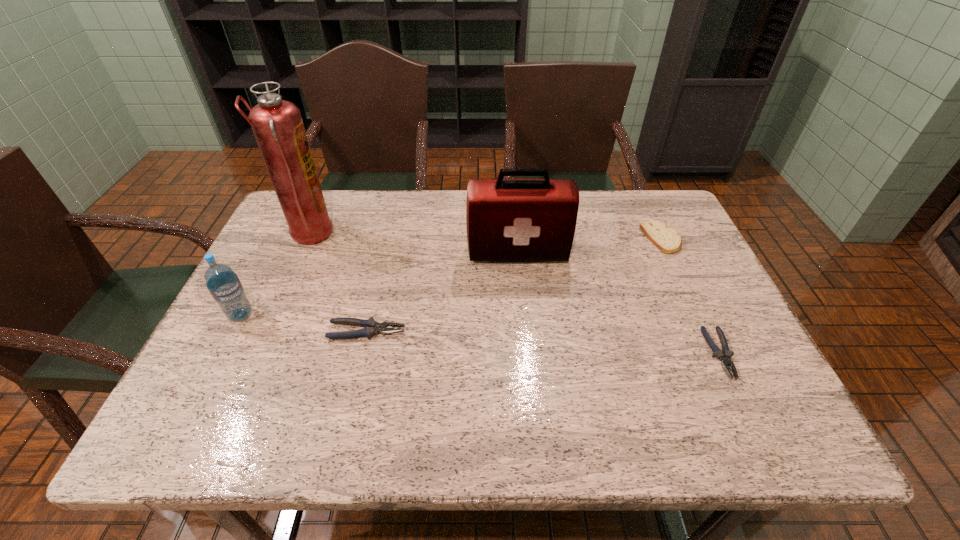
Where is `pita bread at the right edge`? The width and height of the screenshot is (960, 540). pita bread at the right edge is located at coordinates [666, 239].

At what (x,y) coordinates should I click in order to perform the action: click on object situated at the far left corner. Please return your answer as a coordinate pair (x, y). The image size is (960, 540). Looking at the image, I should click on (277, 124).

In order to click on object present at the far right corner in this screenshot , I will do `click(666, 239)`.

Where is `object situated at the near right corner`? Image resolution: width=960 pixels, height=540 pixels. object situated at the near right corner is located at coordinates (725, 357).

In the image, there is a desktop. At what (x,y) coordinates should I click in order to perform the action: click on vacant space at the far edge. Please return your answer as a coordinate pair (x, y). Image resolution: width=960 pixels, height=540 pixels. Looking at the image, I should click on (351, 204).

Find the location of a particular element. free spot at the near edge of the desktop is located at coordinates (379, 375).

Where is `vacant space at the left edge`? This screenshot has height=540, width=960. vacant space at the left edge is located at coordinates (270, 307).

Image resolution: width=960 pixels, height=540 pixels. Identify the location of vacant space at the right edge of the desktop. (660, 265).

I want to click on blank space at the near left corner of the desktop, so click(216, 387).

I want to click on vacant region between the shorter pliers and the first aid kit, so click(x=619, y=303).